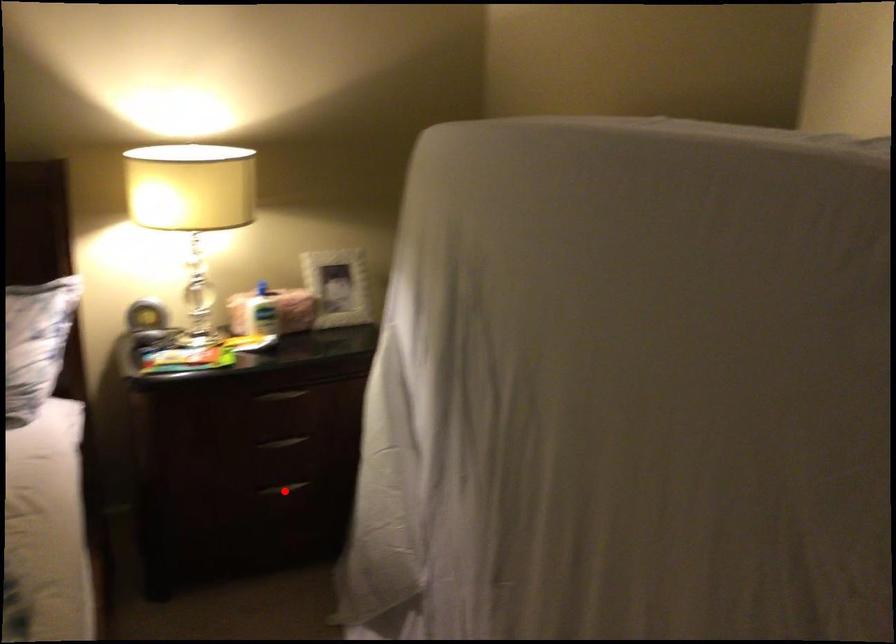
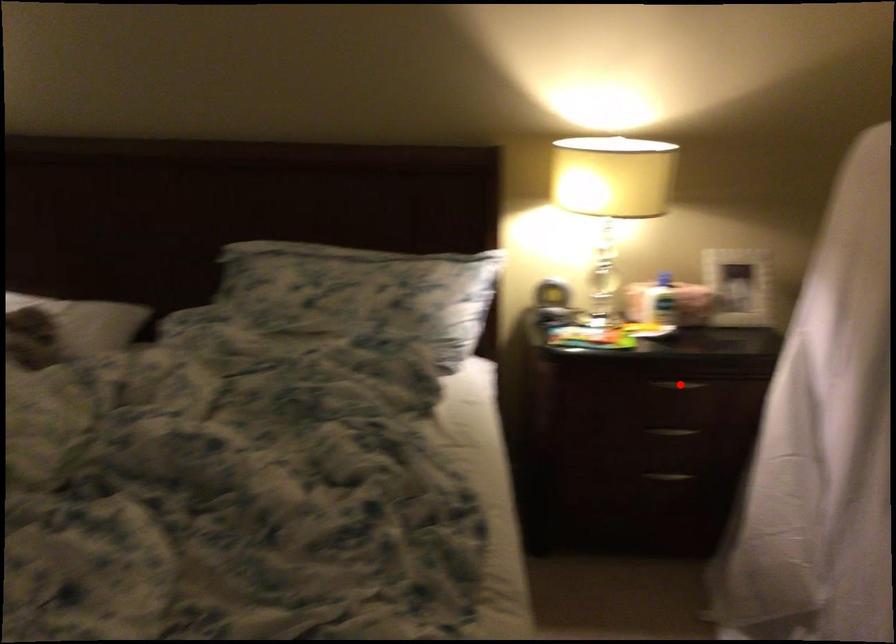
I am providing you with two images of the same scene from different viewpoints. A red point is marked on the first image and another point is marked on the second image. Do the highlighted points in image1 and image2 indicate the same real-world spot?

No